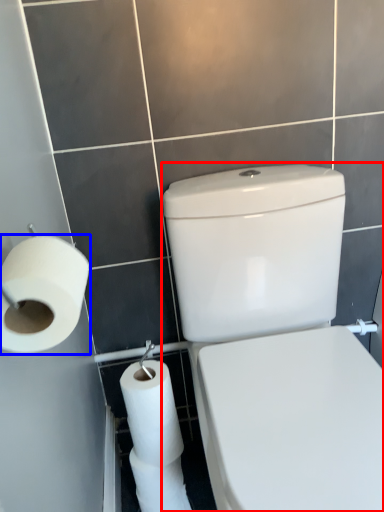
Question: Which of the following is the closest to the observer, porcelain (highlighted by a red box) or toilet paper (highlighted by a blue box)?

Choices:
 (A) porcelain
 (B) toilet paper

Answer: (A)